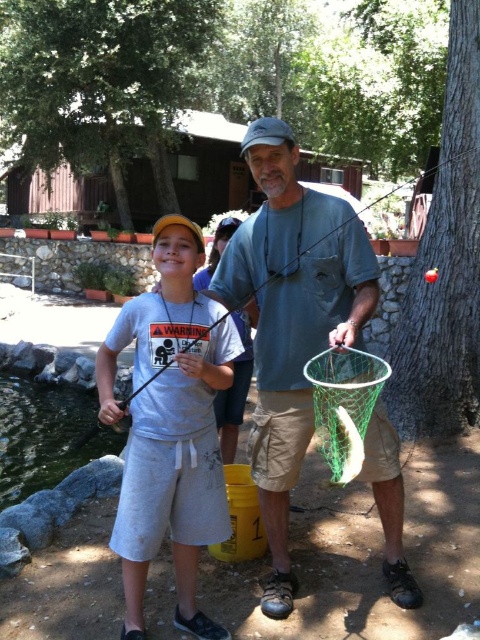
The father and son are standing near each other. The father has a green mesh net at center. How far apart are they?

They are 7.16 feet apart.

In the scene where a father and son are fishing, you see the green mesh net at center and the white matte fish at center. Which object is positioned closer to the left side of the image?

The green mesh net at center is to the left of the white matte fish at center, so the green mesh net at center is closer to the left side of the image.